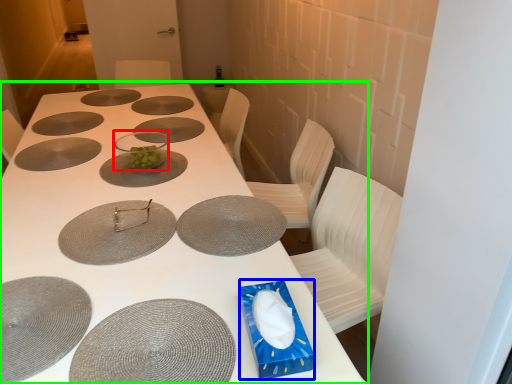
Question: Which object is the farthest from glass bowl (highlighted by a red box)? Choose among these: box (highlighted by a blue box) or table (highlighted by a green box).

Choices:
 (A) box
 (B) table

Answer: (A)